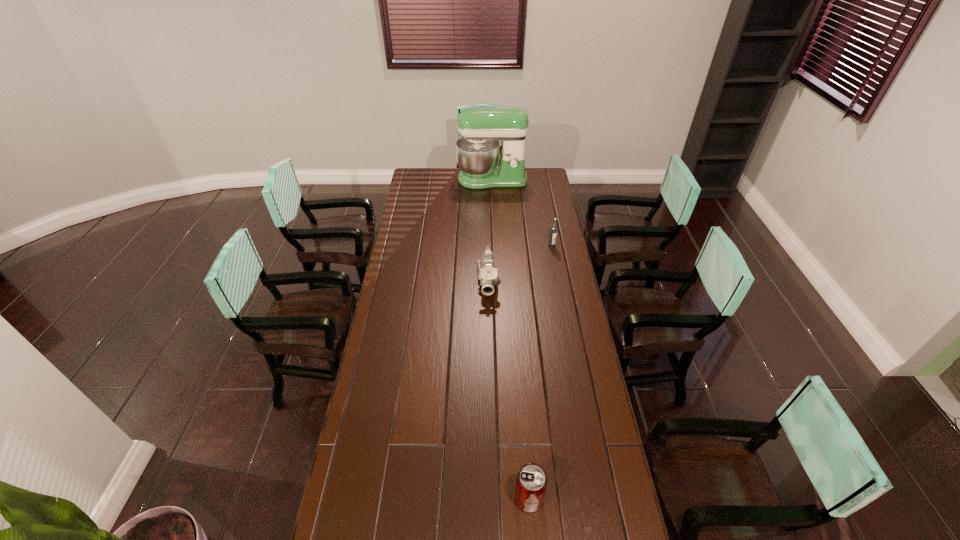
The height and width of the screenshot is (540, 960). Identify the location of object at the far edge. (477, 150).

Where is `mixer situated at the right edge`? mixer situated at the right edge is located at coordinates (477, 150).

What are the coordinates of `vodka located in the right edge section of the desktop` in the screenshot? It's located at (553, 230).

You are a GUI agent. You are given a task and a screenshot of the screen. Output one action in this format:
    pyautogui.click(x=<x>, y=<y>)
    Task: Click on the object at the far right corner
    
    Given the screenshot: What is the action you would take?
    pyautogui.click(x=477, y=150)

The height and width of the screenshot is (540, 960). In the image, there is a desktop. Find the location of `vacant area at the left edge`. vacant area at the left edge is located at coordinates (421, 258).

Locate an element on the screen. Image resolution: width=960 pixels, height=540 pixels. free space at the right edge of the desktop is located at coordinates (564, 272).

Locate an element on the screen. Image resolution: width=960 pixels, height=540 pixels. free region at the far left corner of the desktop is located at coordinates (434, 174).

Where is `vacant space at the far right corner`? The width and height of the screenshot is (960, 540). vacant space at the far right corner is located at coordinates (546, 176).

Image resolution: width=960 pixels, height=540 pixels. In order to click on unoccupied position between the pop soda and the third nearest object in this screenshot , I will do `click(540, 372)`.

Identify the location of free space that is in between the nearest object and the tallest object. (510, 339).